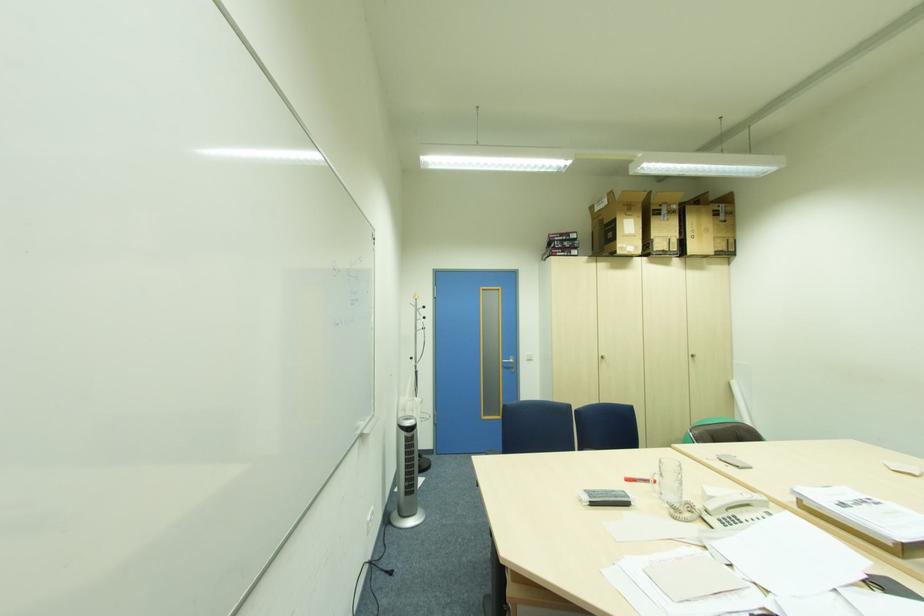
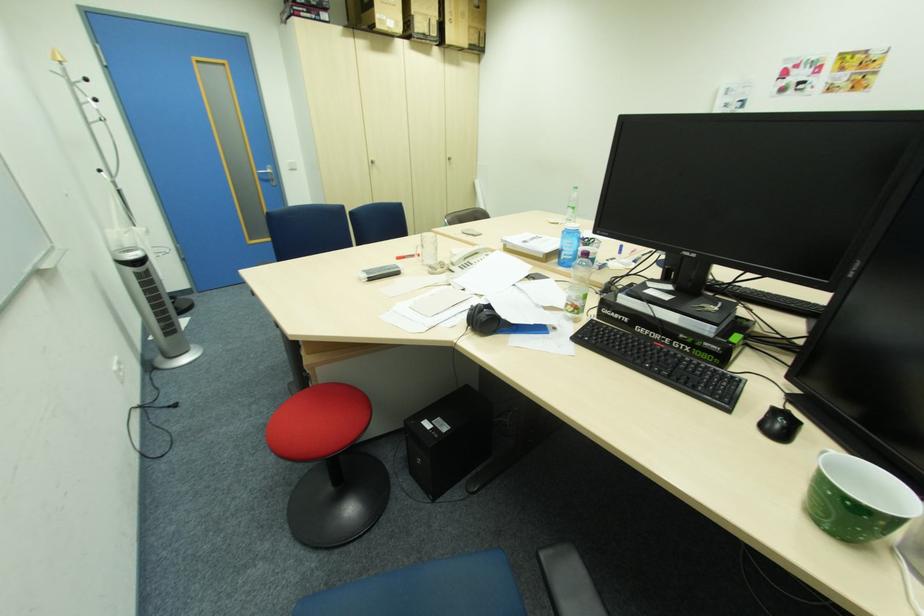
The point at (420,296) is marked in the first image. Where is the corresponding point in the second image?

(62, 55)